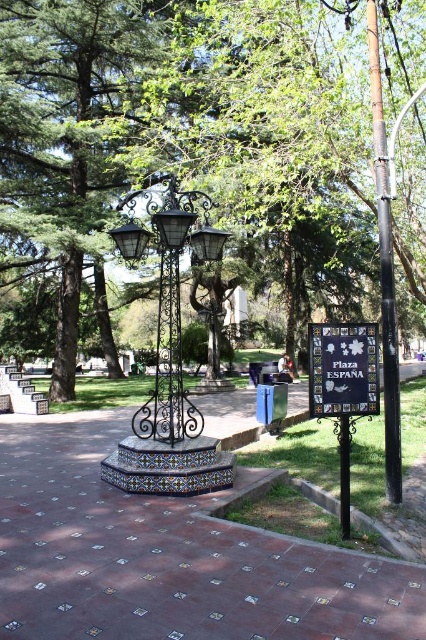
Is point (204, 195) farther from viewer compared to point (348, 472)?

Yes, it is behind point (348, 472).

Is point (178, 314) closer to camera compared to point (342, 432)?

No, it is not.

Which is behind, point (170, 381) or point (340, 516)?

Positioned behind is point (170, 381).

What are the coordinates of `black wrought iron street light at center` in the screenshot? It's located at (169, 298).

Can you confirm if terracotta tiles at center is wider than black matte pole at right?

Correct, the width of terracotta tiles at center exceeds that of black matte pole at right.

Between terracotta tiles at center and black matte pole at right, which one has more height?

With more height is black matte pole at right.

I want to click on terracotta tiles at center, so click(167, 556).

Is green leafy tree at center bigger than black wrought iron street light at center?

Yes.

Consider the image. Who is lower down, green leafy tree at center or black wrought iron street light at center?

black wrought iron street light at center

Who is more forward, (238, 65) or (204, 227)?

Point (204, 227) is more forward.

Find the location of a particular element. green leafy tree at center is located at coordinates (184, 140).